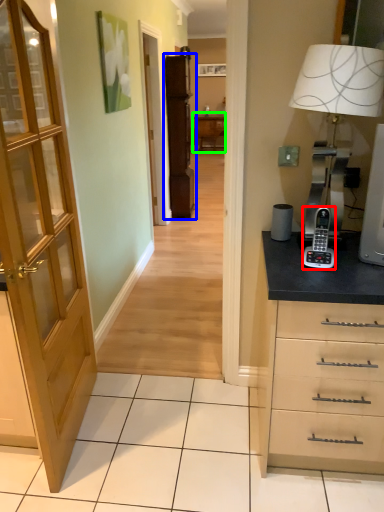
Question: Which is farther away from gadget (highlighted by a red box)? file cabinet (highlighted by a blue box) or table (highlighted by a green box)?

Choices:
 (A) file cabinet
 (B) table

Answer: (B)